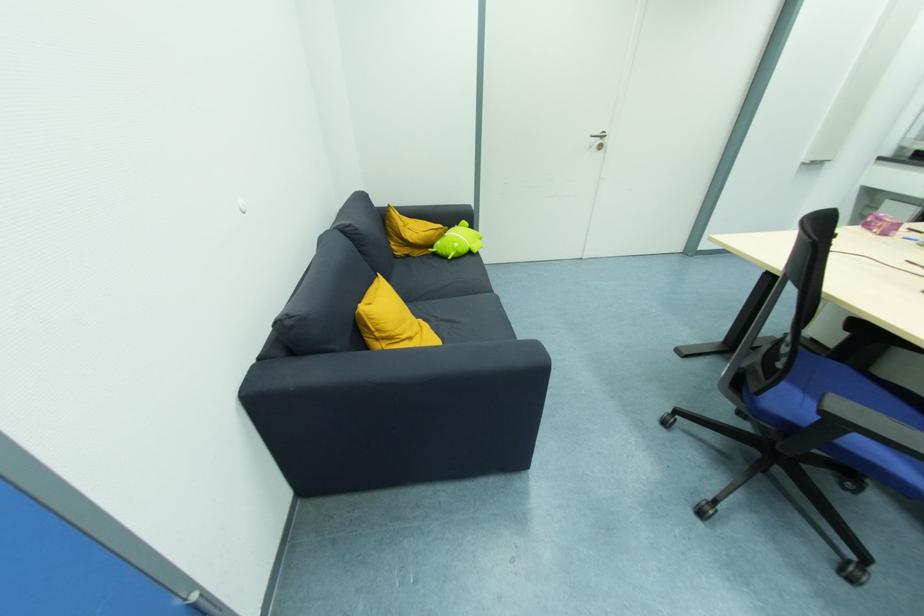
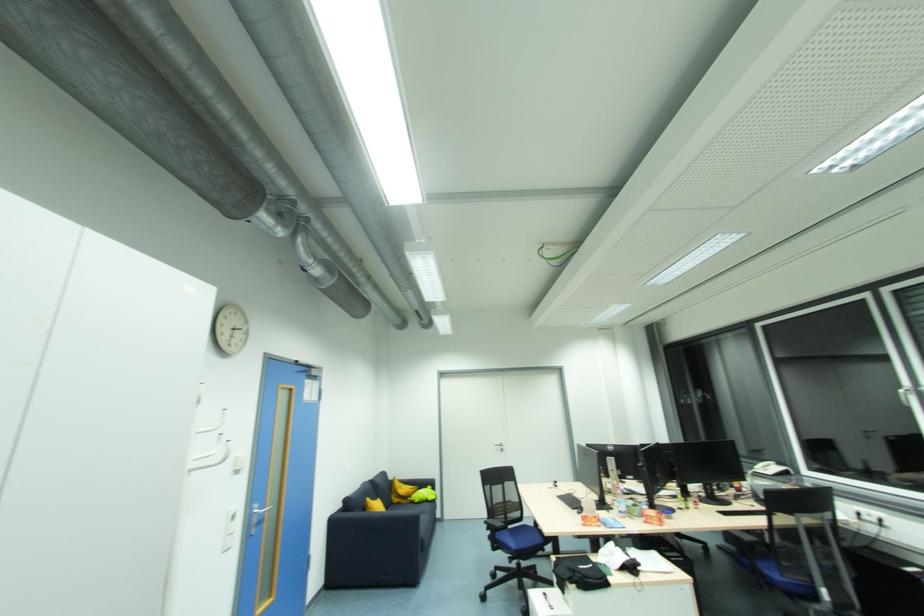
Where in the second image is the point corresponding to point 435,248 from the first image?

(412, 499)